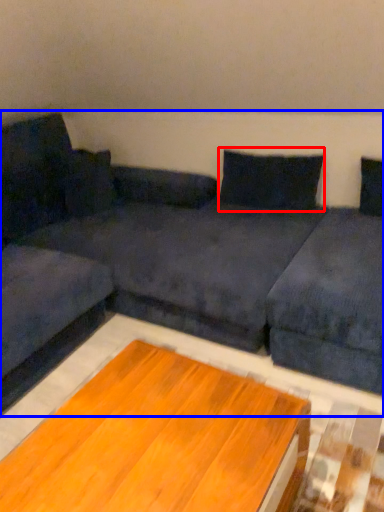
Question: Which of the following is the closest to the observer, pillow (highlighted by a red box) or studio couch (highlighted by a blue box)?

Choices:
 (A) pillow
 (B) studio couch

Answer: (B)